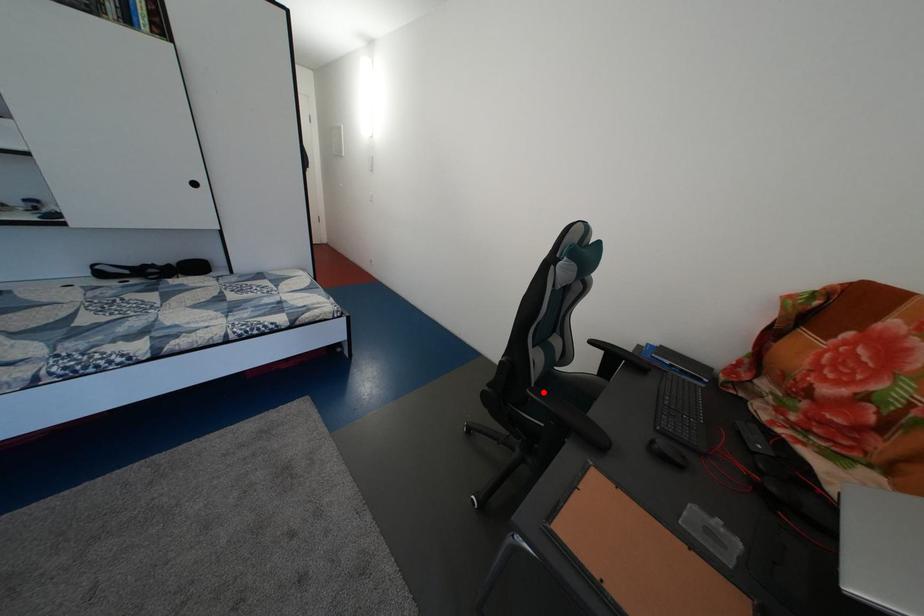
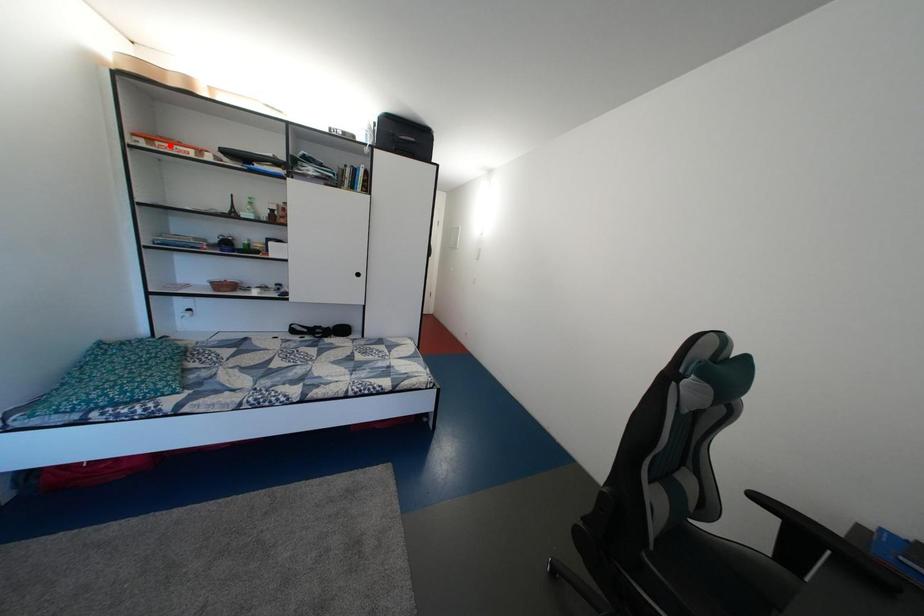
I am providing you with two images of the same scene from different viewpoints. A red point is marked on the first image and another point is marked on the second image. Is the red point in image1 aligned with the point shown in image2?

No